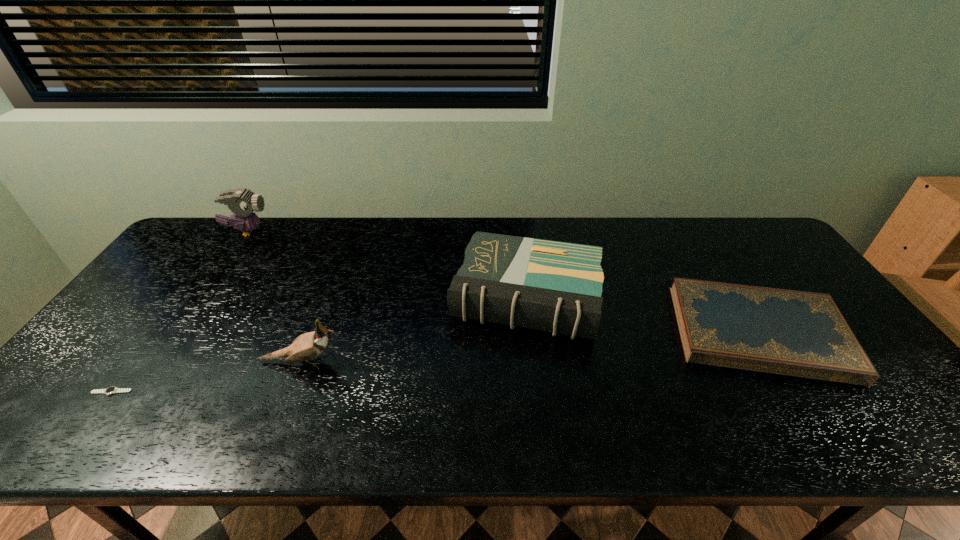
Where is `vacant area at the far edge of the desktop`? The width and height of the screenshot is (960, 540). vacant area at the far edge of the desktop is located at coordinates tap(641, 234).

You are a GUI agent. You are given a task and a screenshot of the screen. Output one action in this format:
    pyautogui.click(x=<x>, y=<y>)
    Task: Click on the vacant region at the near edge of the desktop
    Image resolution: width=960 pixels, height=540 pixels.
    Given the screenshot: What is the action you would take?
    pyautogui.click(x=772, y=427)

At what (x,y) coordinates should I click in order to perform the action: click on vacant space at the left edge of the desktop. Please return your answer as a coordinate pair (x, y). Looking at the image, I should click on (126, 323).

The height and width of the screenshot is (540, 960). In the image, there is a desktop. In order to click on vacant space at the near left corner in this screenshot , I will do `click(115, 410)`.

Where is `free region at the far right corner of the desktop`? free region at the far right corner of the desktop is located at coordinates (751, 239).

Identify the location of free spot between the taller paperback book and the farther bird. (387, 264).

Locate an element on the screen. Image resolution: width=960 pixels, height=540 pixels. free point between the left bird and the taller paperback book is located at coordinates (387, 264).

Where is `free space between the shortest object and the right paperback book`? The height and width of the screenshot is (540, 960). free space between the shortest object and the right paperback book is located at coordinates (435, 362).

You are a GUI agent. You are given a task and a screenshot of the screen. Output one action in this format:
    pyautogui.click(x=<x>, y=<y>)
    Task: Click on the free space between the right bird and the right paperback book
    The height and width of the screenshot is (540, 960).
    Given the screenshot: What is the action you would take?
    pyautogui.click(x=530, y=347)

The image size is (960, 540). I want to click on vacant area that lies between the right bird and the watch, so click(206, 376).